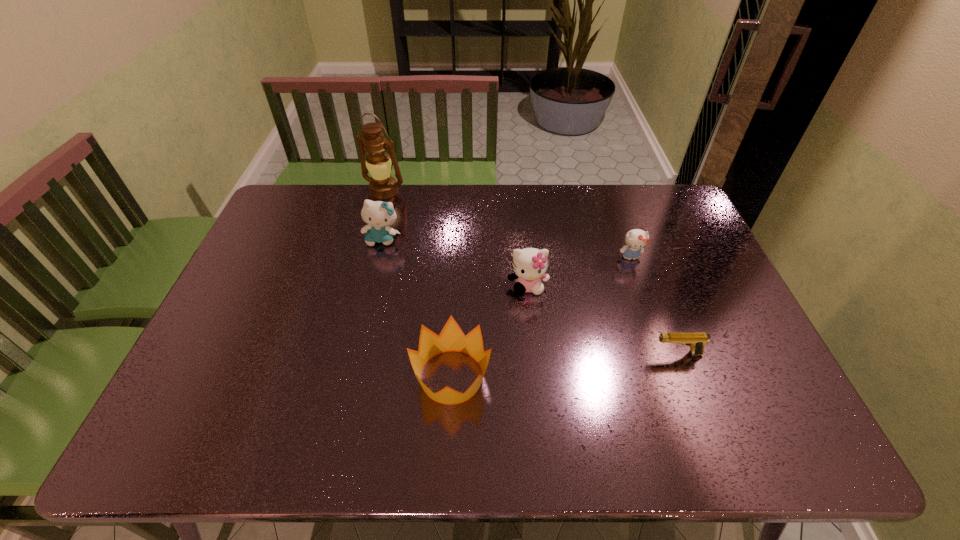
Find the location of a particular element. The height and width of the screenshot is (540, 960). the tallest object is located at coordinates (382, 186).

Identify the location of the farthest object. The image size is (960, 540). (382, 186).

Where is `the leftmost kitten`? the leftmost kitten is located at coordinates (378, 215).

Locate an element on the screen. This screenshot has height=540, width=960. the farthest kitten is located at coordinates (378, 215).

Locate an element on the screen. The height and width of the screenshot is (540, 960). the second kitten from right to left is located at coordinates (529, 264).

Find the location of a particular element. Image resolution: width=960 pixels, height=540 pixels. the nearest kitten is located at coordinates (529, 264).

Locate an element on the screen. This screenshot has width=960, height=540. the fourth object from right to left is located at coordinates (451, 338).

Image resolution: width=960 pixels, height=540 pixels. I want to click on the rightmost kitten, so click(x=636, y=239).

Find the location of a particular element. The height and width of the screenshot is (540, 960). the second nearest kitten is located at coordinates (636, 239).

Where is `pistol`? The width and height of the screenshot is (960, 540). pistol is located at coordinates (696, 340).